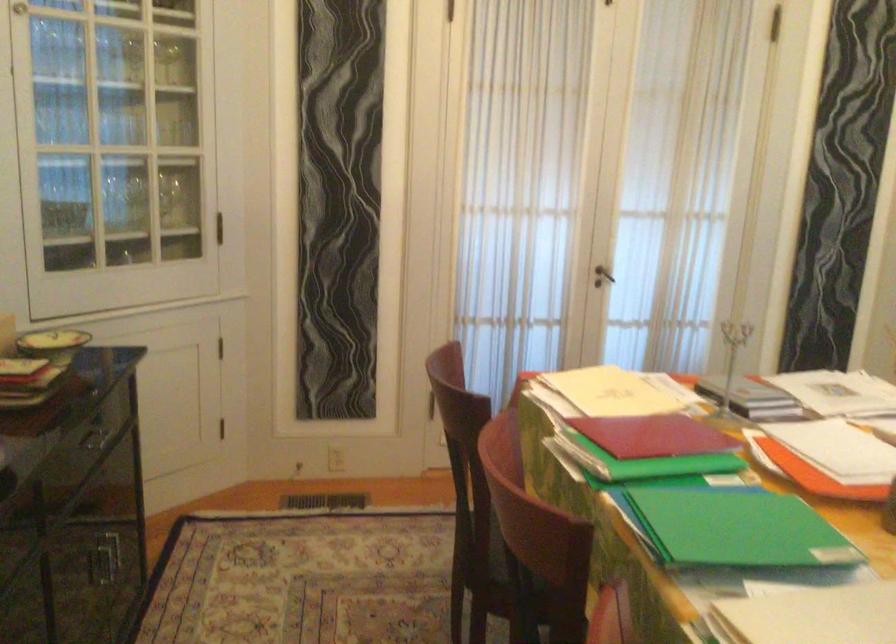
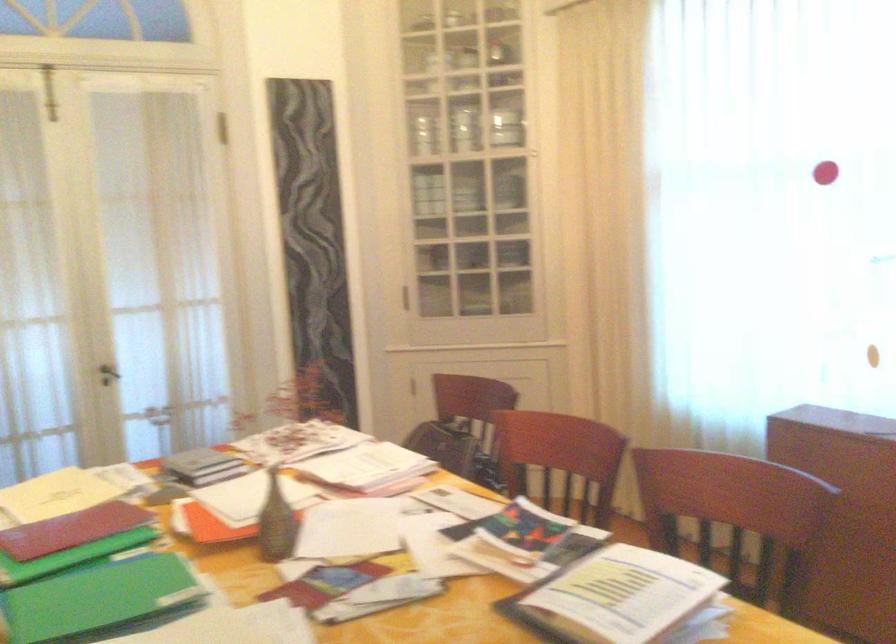
What movement of the cameraman would produce the second image?

The cameraman walked toward right, backward.